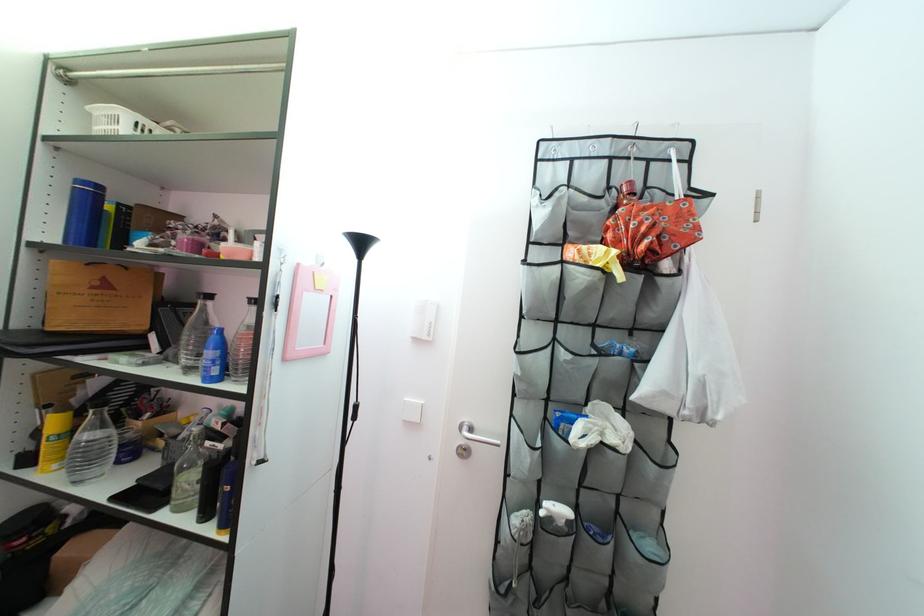
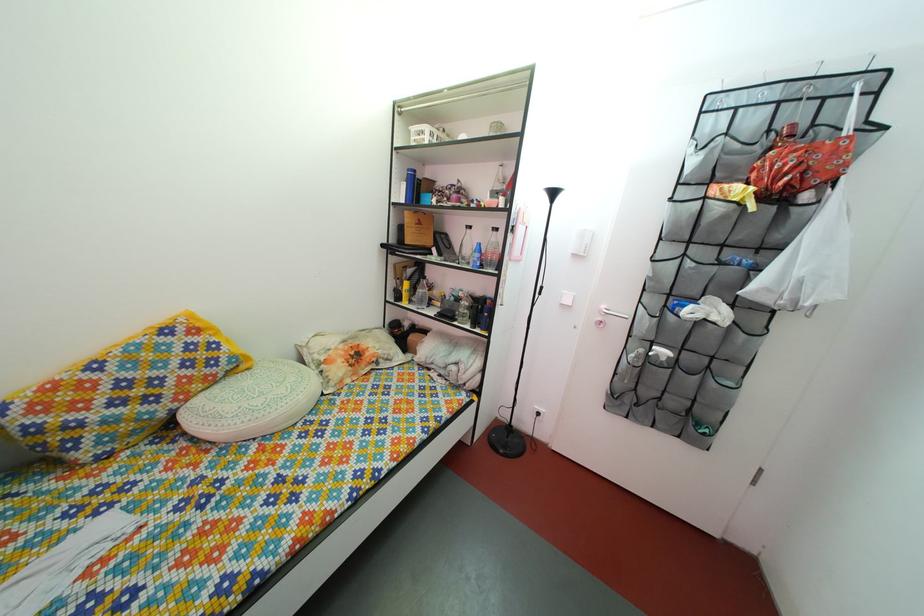
Question: How did the camera likely rotate?

Choices:
 (A) Left
 (B) Right
 (C) Up
 (D) Down

Answer: (A)